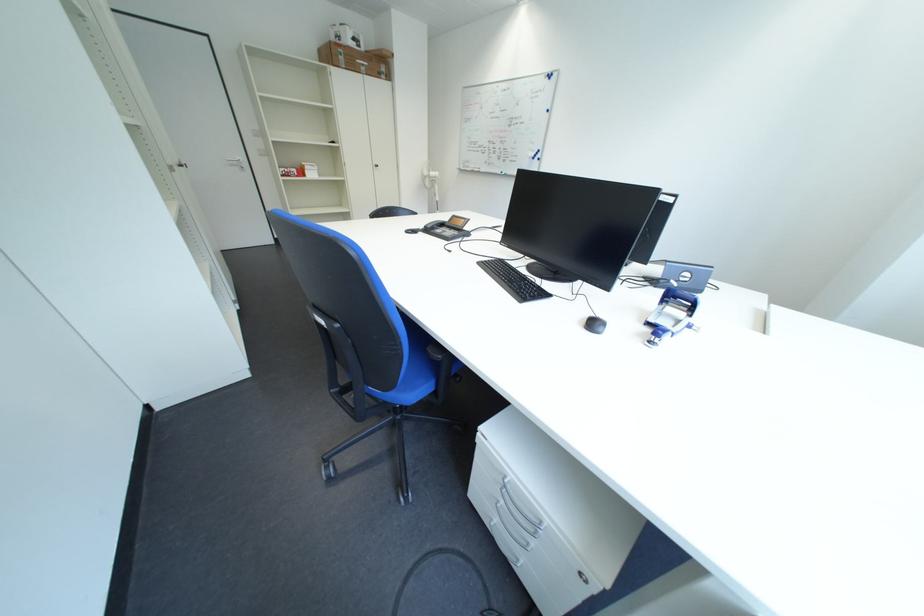
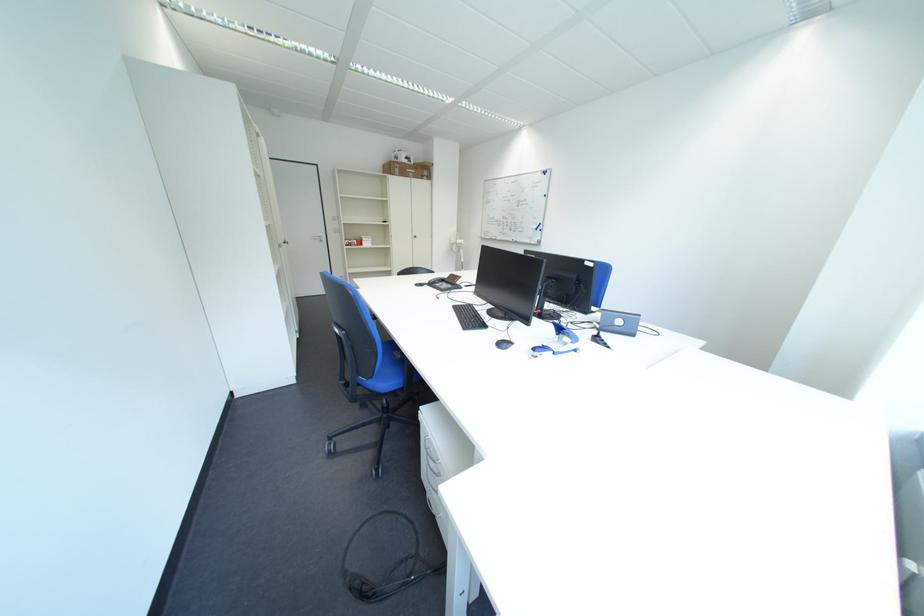
Question: The first image is from the beginning of the video and the second image is from the end. How did the camera likely rotate when shooting the video?

Choices:
 (A) Left
 (B) Right
 (C) Up
 (D) Down

Answer: (C)